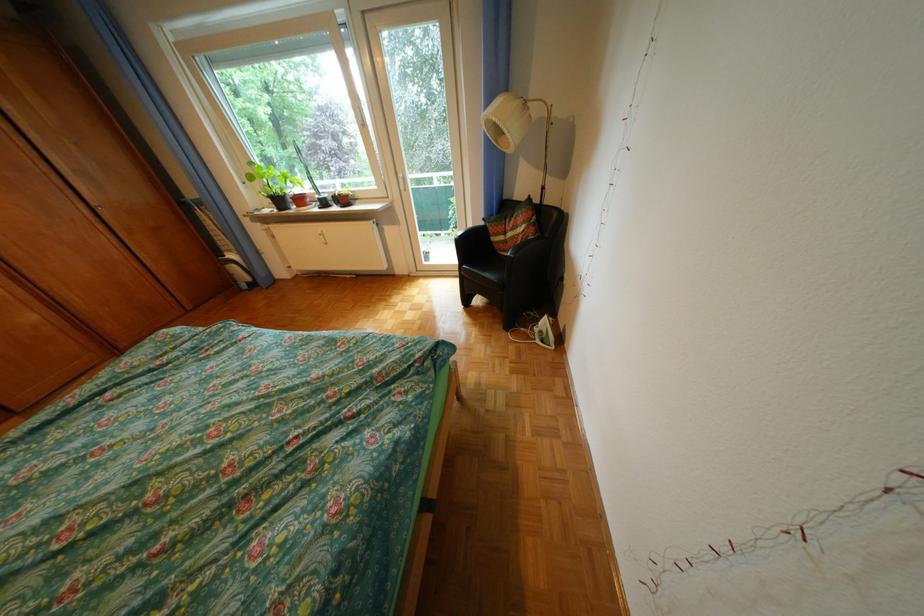
Find the location of a particular element. chair armrest is located at coordinates (468, 233).